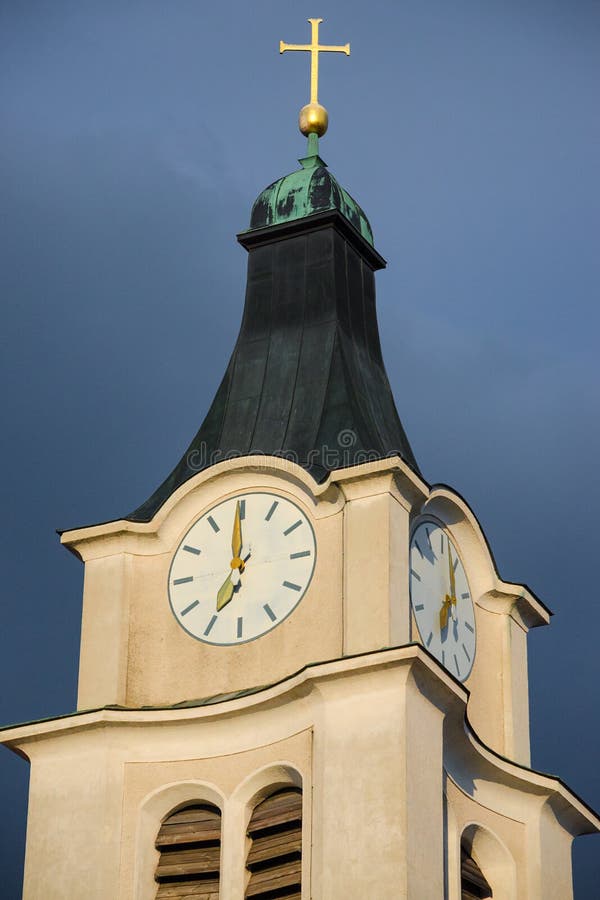
The height and width of the screenshot is (900, 600). I want to click on wooden shades, so click(x=280, y=816), click(x=181, y=824), click(x=477, y=877).